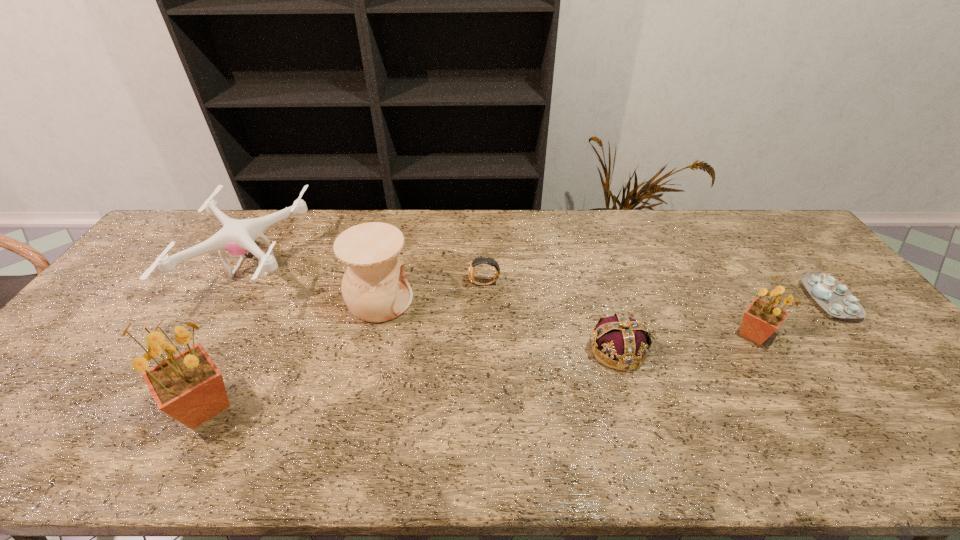
What are the coordinates of `the nearer sunflower` in the screenshot? It's located at (189, 387).

Locate an element on the screen. This screenshot has width=960, height=540. the left sunflower is located at coordinates (189, 387).

Identify the location of the right sunflower. (761, 319).

At what (x,y) coordinates should I click in order to perform the action: click on the shorter sunflower. Please return your answer as a coordinate pair (x, y). The image size is (960, 540). Looking at the image, I should click on [x=761, y=319].

Where is `drone`? This screenshot has height=540, width=960. drone is located at coordinates (237, 237).

Where is `the shortest object`? the shortest object is located at coordinates (834, 297).

Locate an element on the screen. chinaware is located at coordinates (834, 297).

Image resolution: width=960 pixels, height=540 pixels. In order to click on the third object from left to right in this screenshot , I will do `click(374, 287)`.

You are a GUI agent. You are given a task and a screenshot of the screen. Output one action in this format:
    pyautogui.click(x=<x>, y=<y>)
    Task: Click on the third shortest object
    This screenshot has height=540, width=960.
    Given the screenshot: What is the action you would take?
    pyautogui.click(x=627, y=341)

The width and height of the screenshot is (960, 540). Identify the location of crown. (627, 341).